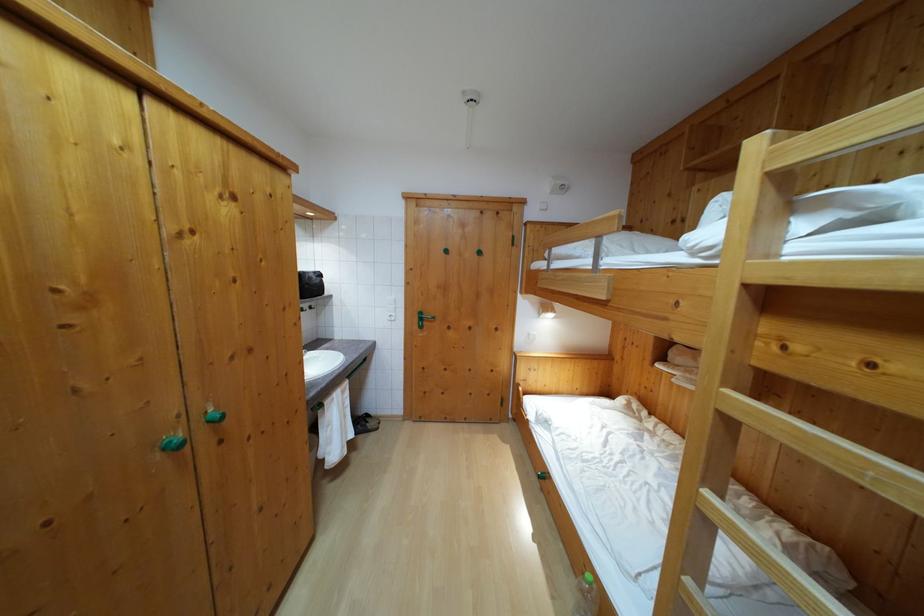
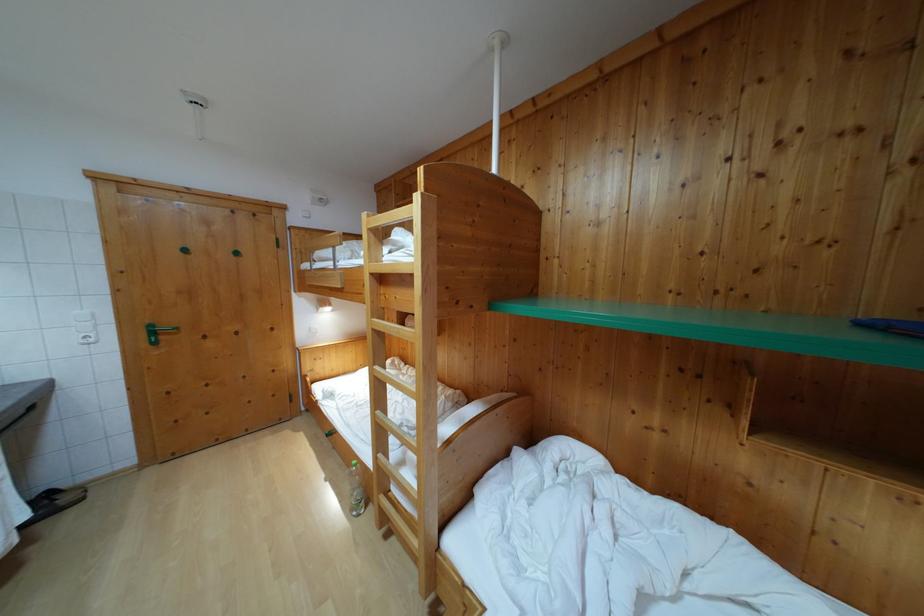
Where in the second image is the point corresponding to (355,442) from the first image?

(28, 524)